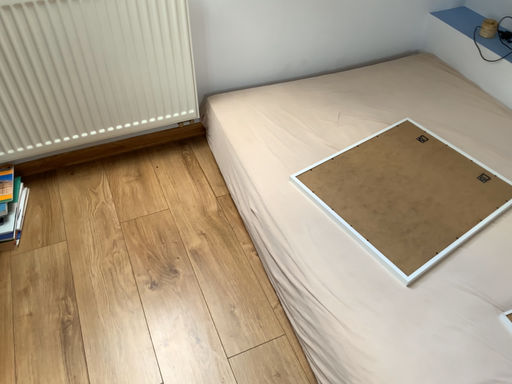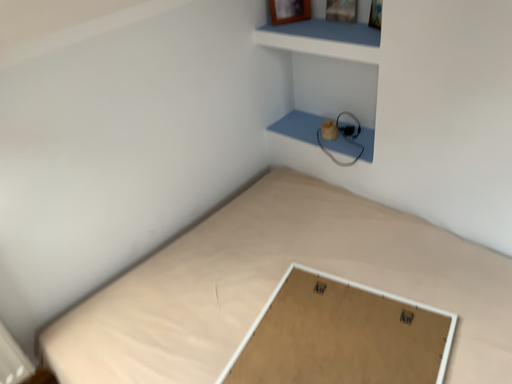
Question: How did the camera likely rotate when shooting the video?

Choices:
 (A) rotated upward
 (B) rotated downward

Answer: (A)